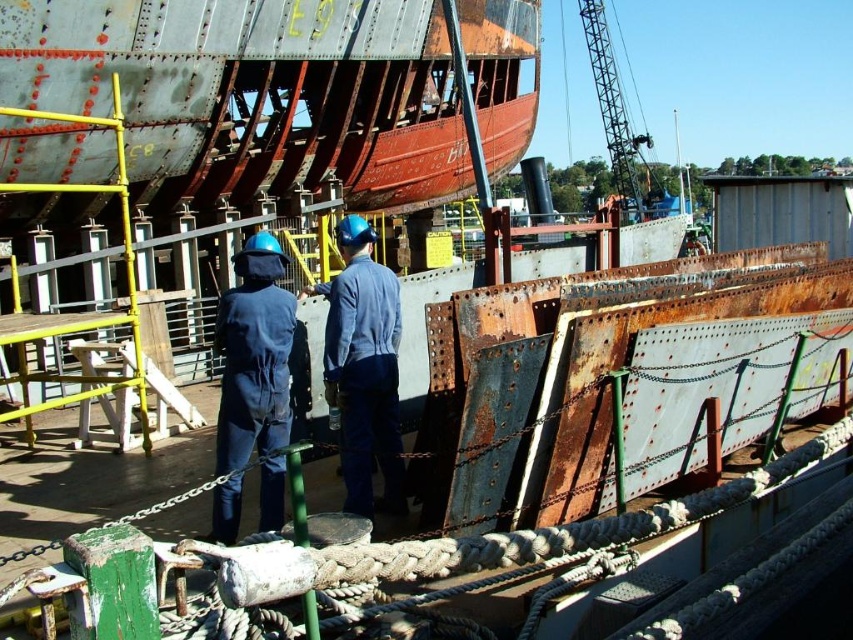
You are a safety inspector at the shipyard and need to ensure that the blue denim shirt at center and the brushed metal crane at upper center are visible from the control room. Based on their positions, which object is closer to the control room entrance located to the right of the crane?

The blue denim shirt at center is to the left of the brushed metal crane at upper center, so the crane is closer to the control room entrance on its right side. Therefore, the brushed metal crane at upper center would be closer to the control room entrance.

You are a safety inspector on the shipyard. You need to determine if the blue fabric jumpsuit at center is within the safe height limit under the brushed metal crane at upper center. What is the relationship between their heights?

The blue fabric jumpsuit at center is shorter than the brushed metal crane at upper center, so it is within the safe height limit.